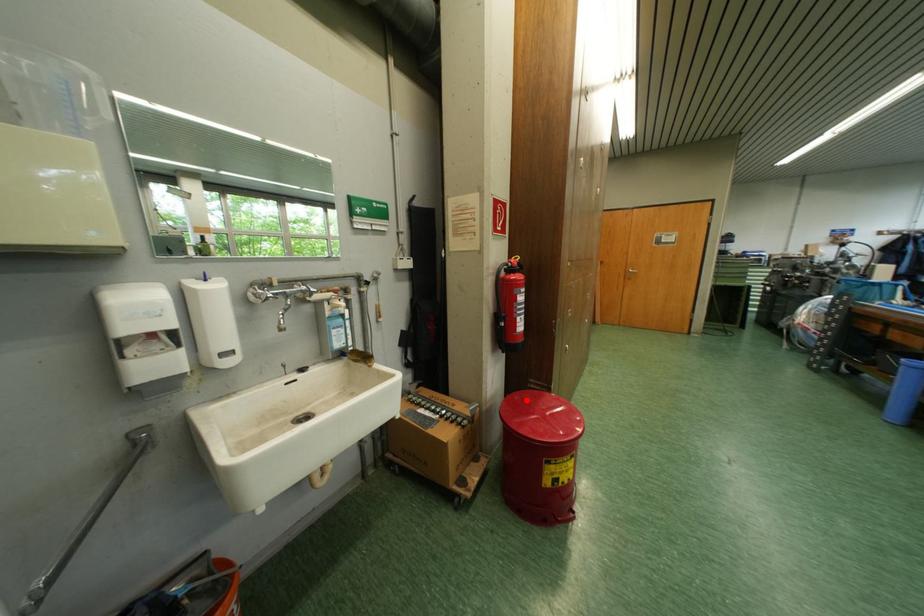
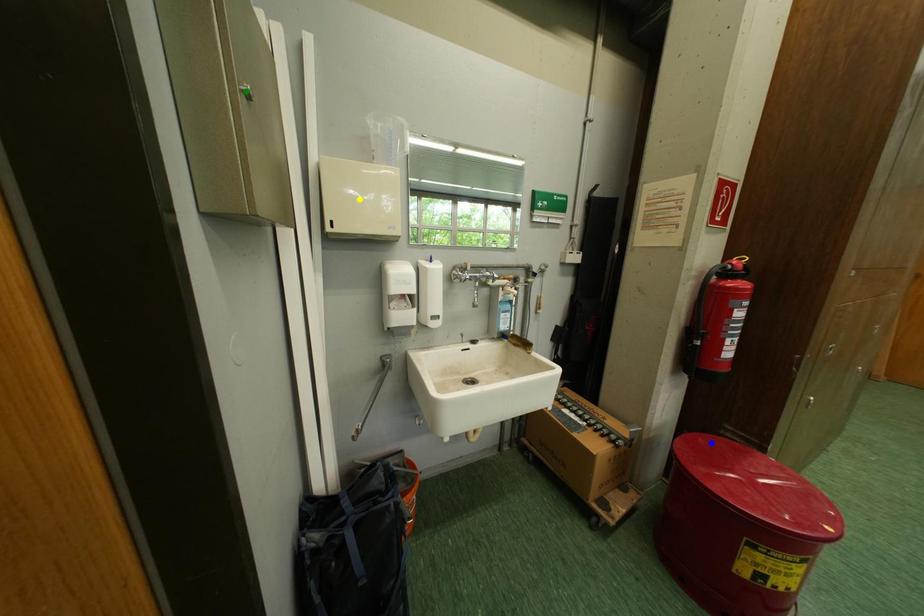
Question: I am providing you with two images of the same scene from different viewpoints. A red point is marked on the first image. You are given multiple points on the second image. In image 2, which mark is for the same physical point as the one in image 1?

Choices:
 (A) yellow point
 (B) blue point
 (C) green point

Answer: (B)